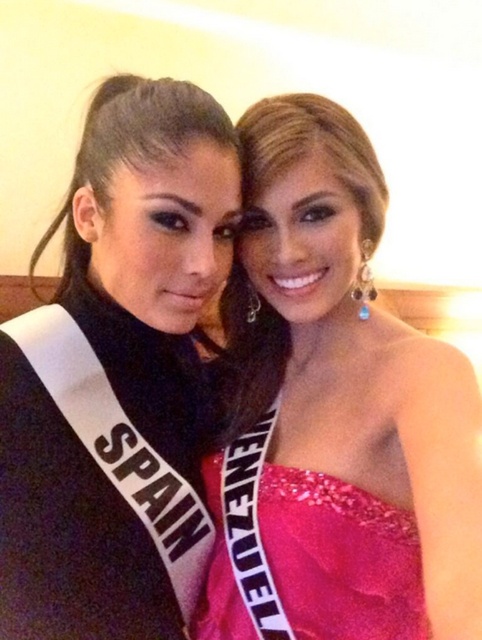
From the picture: Can you confirm if black satin sash at left is taller than pink sequined dress at center?

Yes.

Does point (187, 348) come in front of point (308, 636)?

No.

Is point (9, 600) positioned after point (357, 490)?

No, (9, 600) is closer to viewer.

Find the location of a particular element. black satin sash at left is located at coordinates (118, 378).

Does pink satin dress at center have a larger size compared to black satin sash at left?

Actually, pink satin dress at center might be smaller than black satin sash at left.

Looking at this image, is pink satin dress at center positioned in front of black satin sash at left?

Yes, pink satin dress at center is in front of black satin sash at left.

Find the location of a particular element. This screenshot has height=640, width=482. pink satin dress at center is located at coordinates (334, 413).

Identify the location of pink satin dress at center. [x=334, y=413].

Can you confirm if pink satin dress at center is smaller than pink sequined dress at center?

No.

Does pink satin dress at center appear over pink sequined dress at center?

Yes.

You are a GUI agent. You are given a task and a screenshot of the screen. Output one action in this format:
    pyautogui.click(x=<x>, y=<y>)
    Task: Click on the pink satin dress at center
    This screenshot has width=482, height=640.
    Given the screenshot: What is the action you would take?
    pyautogui.click(x=334, y=413)

The width and height of the screenshot is (482, 640). In order to click on pink satin dress at center in this screenshot , I will do `click(334, 413)`.